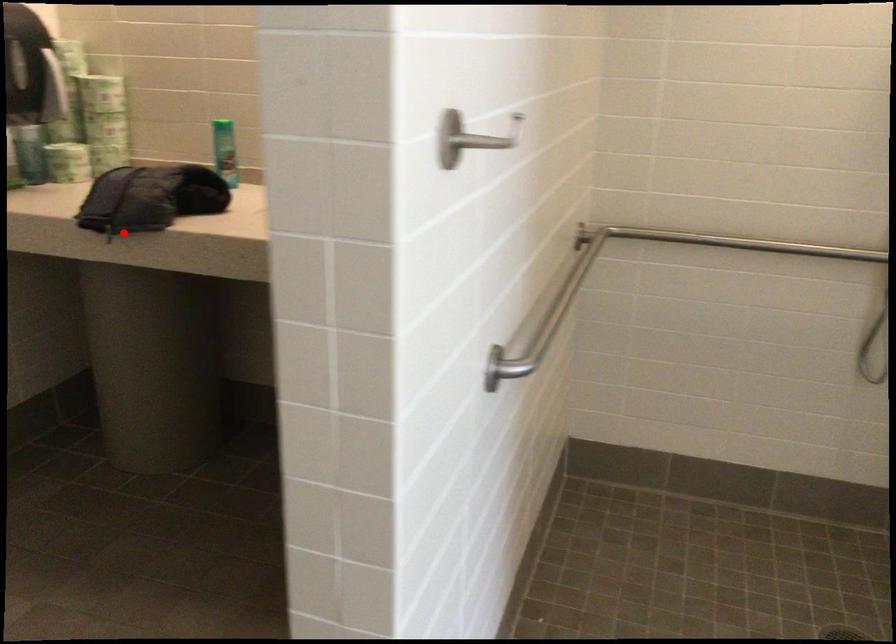
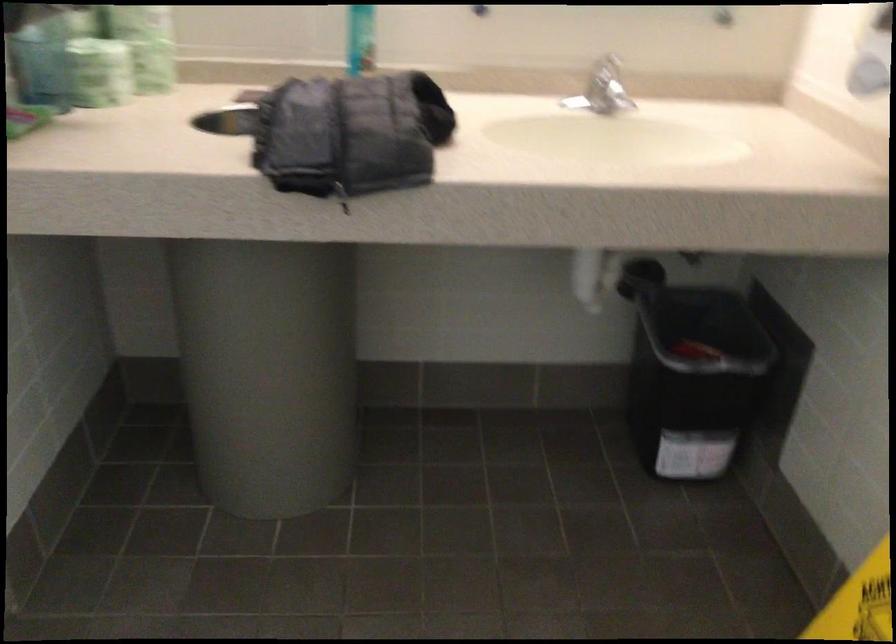
Where in the second image is the point corresponding to the highlighted location from the first image?

(341, 196)